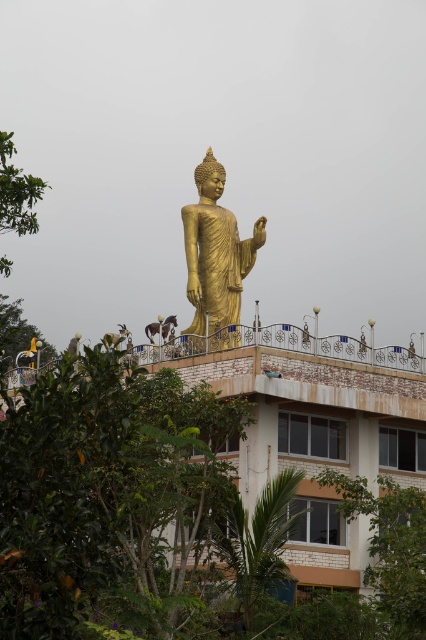
Consider the image. Can you confirm if gold polished statue at center is positioned below green leafy tree at left?

Yes.

Where is `gold polished statue at center`? This screenshot has height=640, width=426. gold polished statue at center is located at coordinates (215, 252).

What do you see at coordinates (215, 252) in the screenshot? I see `gold polished statue at center` at bounding box center [215, 252].

This screenshot has width=426, height=640. In order to click on gold polished statue at center in this screenshot , I will do `click(215, 252)`.

Who is shorter, green leafy tree at lower right or green leafy tree at lower center?

Standing shorter between the two is green leafy tree at lower center.

Is green leafy tree at lower right to the left of green leafy tree at lower center from the viewer's perspective?

No, green leafy tree at lower right is not to the left of green leafy tree at lower center.

Between point (402, 493) and point (250, 611), which one is positioned in front?

Point (250, 611) is more forward.

The image size is (426, 640). In order to click on green leafy tree at lower right in this screenshot , I will do `click(389, 547)`.

Does green leafy tree at lower center have a lesser width compared to green leafy tree at lower left?

Yes, green leafy tree at lower center is thinner than green leafy tree at lower left.

Does green leafy tree at lower center appear under green leafy tree at lower left?

Yes.

Find the location of a particular element. green leafy tree at lower center is located at coordinates (258, 540).